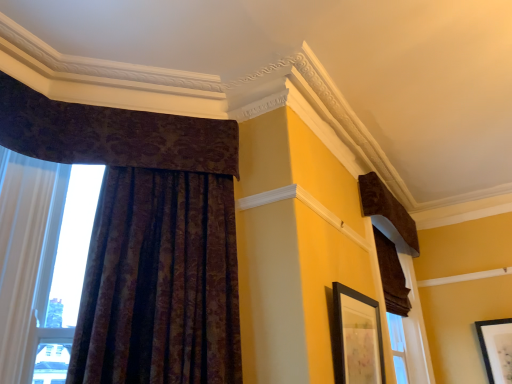
Question: Is dark velvet curtain at upper left, which is counted as the third curtain, starting from the right, at the right side of brown velvet curtain at right, the second curtain in the right-to-left sequence?

Choices:
 (A) yes
 (B) no

Answer: (B)

Question: From a real-world perspective, is dark velvet curtain at upper left, which is counted as the third curtain, starting from the right, on top of brown velvet curtain at right, the second curtain in the right-to-left sequence?

Choices:
 (A) no
 (B) yes

Answer: (B)

Question: Is dark velvet curtain at upper left, the second curtain when ordered from left to right, outside of brown velvet curtain at right, which ranks as the 3th curtain in left-to-right order?

Choices:
 (A) yes
 (B) no

Answer: (A)

Question: Can you confirm if dark velvet curtain at upper left, which is counted as the third curtain, starting from the right, is bigger than brown velvet curtain at right, the second curtain in the right-to-left sequence?

Choices:
 (A) yes
 (B) no

Answer: (B)

Question: Can you confirm if dark velvet curtain at upper left, which is counted as the third curtain, starting from the right, is shorter than brown velvet curtain at right, which ranks as the 3th curtain in left-to-right order?

Choices:
 (A) yes
 (B) no

Answer: (A)

Question: Is black matte picture frame at center, which ranks as the first picture frame in top-to-bottom order, inside or outside of velvet brown curtain at upper right, which is counted as the 4th curtain, starting from the left?

Choices:
 (A) inside
 (B) outside

Answer: (B)

Question: From a real-world perspective, is black matte picture frame at center, the second picture frame positioned from the bottom, physically located above or below velvet brown curtain at upper right, marked as the first curtain in a right-to-left arrangement?

Choices:
 (A) below
 (B) above

Answer: (A)

Question: Is black matte picture frame at center, arranged as the first picture frame when viewed from the left, to the left or to the right of velvet brown curtain at upper right, which is counted as the 4th curtain, starting from the left, in the image?

Choices:
 (A) left
 (B) right

Answer: (A)

Question: Considering the positions of black matte picture frame at center, the second picture frame when ordered from back to front, and velvet brown curtain at upper right, marked as the first curtain in a right-to-left arrangement, in the image, is black matte picture frame at center, the second picture frame when ordered from back to front, taller or shorter than velvet brown curtain at upper right, marked as the first curtain in a right-to-left arrangement,?

Choices:
 (A) tall
 (B) short

Answer: (A)

Question: Based on their positions, is velvet brown curtain at upper right, which is counted as the 4th curtain, starting from the left, located to the left or right of dark velvet curtain at upper left, which is counted as the third curtain, starting from the right?

Choices:
 (A) left
 (B) right

Answer: (B)

Question: Is velvet brown curtain at upper right, which is counted as the 4th curtain, starting from the left, spatially inside dark velvet curtain at upper left, which is counted as the third curtain, starting from the right, or outside of it?

Choices:
 (A) outside
 (B) inside

Answer: (A)

Question: Relative to dark velvet curtain at upper left, which is counted as the third curtain, starting from the right, is velvet brown curtain at upper right, marked as the first curtain in a right-to-left arrangement, in front or behind?

Choices:
 (A) behind
 (B) front

Answer: (A)

Question: Is velvet brown curtain at upper right, which is counted as the 4th curtain, starting from the left, bigger or smaller than dark velvet curtain at upper left, which is counted as the third curtain, starting from the right?

Choices:
 (A) big
 (B) small

Answer: (A)

Question: From the image's perspective, relative to dark velvet curtain at upper left, the second curtain when ordered from left to right, is brown velvet curtain at right, which ranks as the 3th curtain in left-to-right order, above or below?

Choices:
 (A) below
 (B) above

Answer: (A)

Question: Relative to dark velvet curtain at upper left, which is counted as the third curtain, starting from the right, is brown velvet curtain at right, the second curtain in the right-to-left sequence, in front or behind?

Choices:
 (A) behind
 (B) front

Answer: (A)